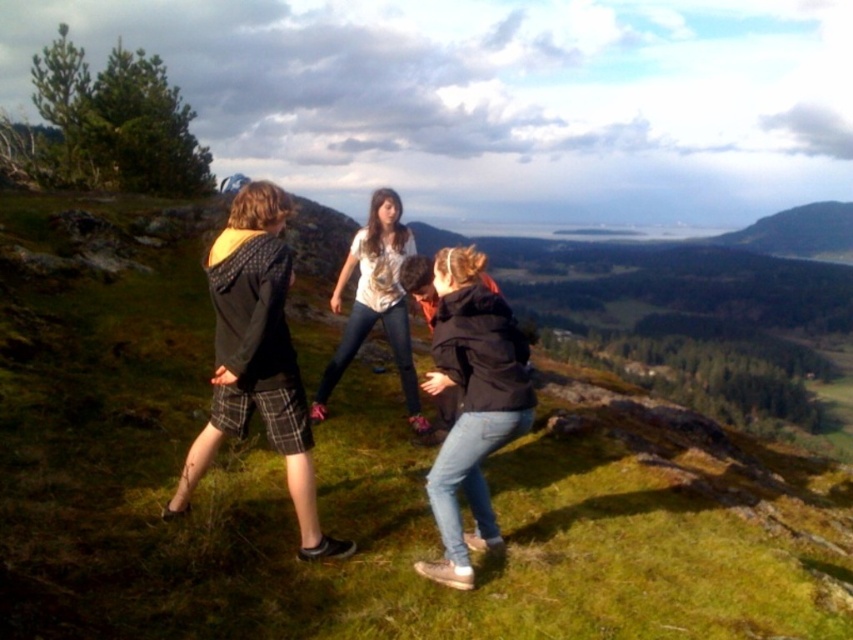
You are standing on the grassy hillside and want to place a small picnic basket between the green grassy at center and the white textured blouse at center. Based on their positions, where should you place the basket?

The green grassy at center is located below the white textured blouse at center, so you should place the picnic basket between them by positioning it on the grassy area below the white textured blouse at center.

You are standing on the grassy hillside and want to walk from the plaid shorts at left to the denim jeans at center. Which direction should you move to reach there?

To move from the plaid shorts at left to the denim jeans at center, you should walk upwards since the plaid shorts at left is located below denim jeans at center.